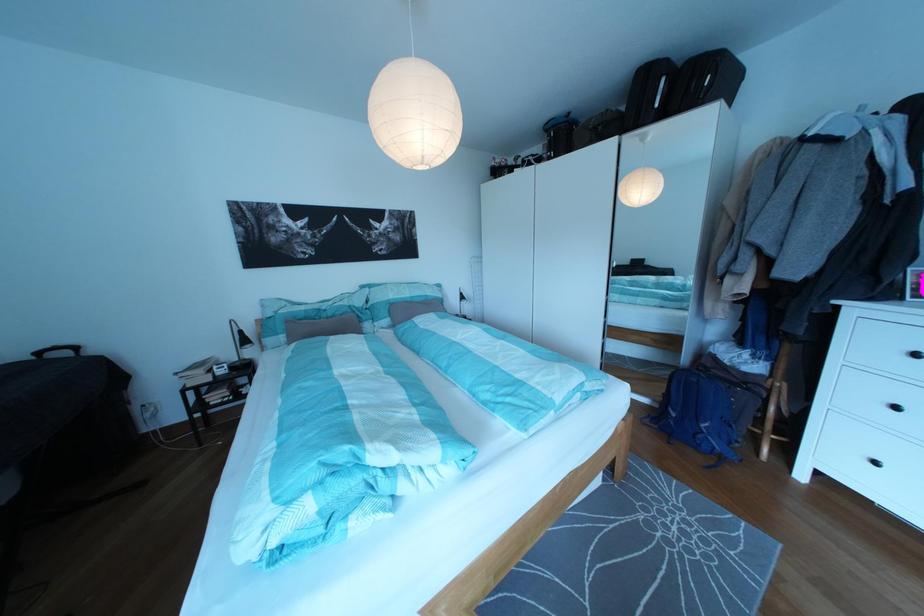
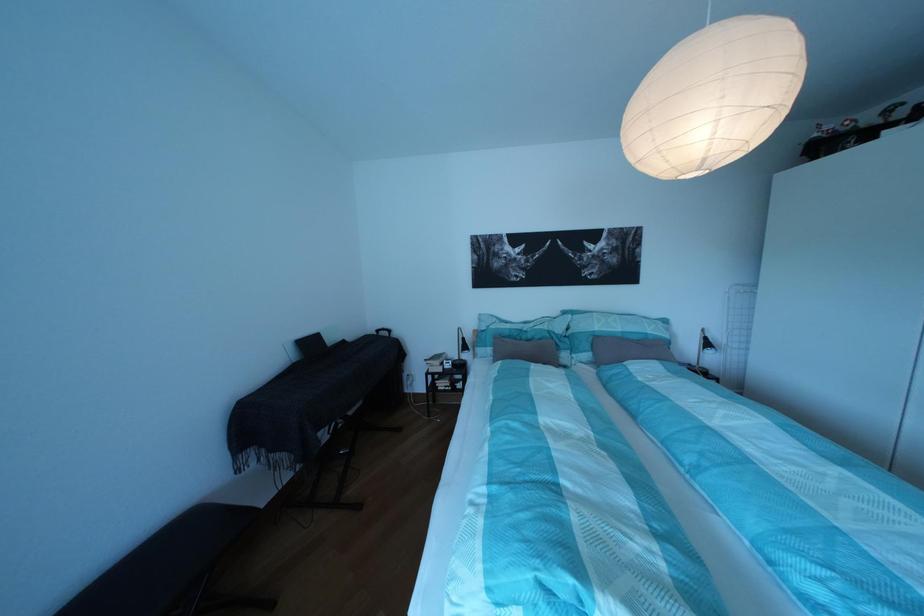
Find the pixel in the second image that matches (422,306) in the first image.

(633, 341)